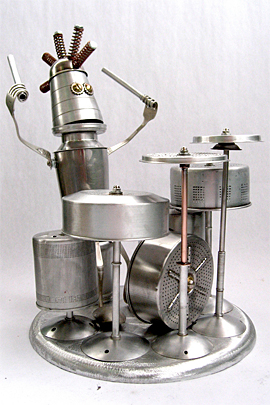
The height and width of the screenshot is (405, 270). I want to click on fork, so click(19, 137), click(144, 119).